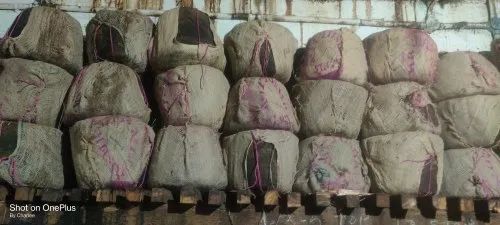
The height and width of the screenshot is (225, 500). I want to click on dirty wall, so (286, 7).